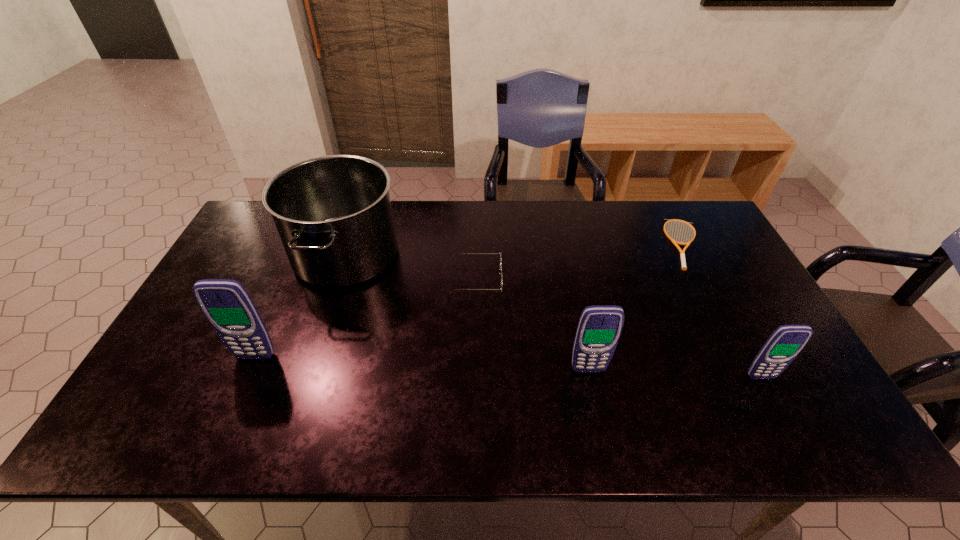
The width and height of the screenshot is (960, 540). Find the location of `vacant area at the near edge`. vacant area at the near edge is located at coordinates (399, 390).

Locate an element on the screen. The width and height of the screenshot is (960, 540). vacant region at the left edge of the desktop is located at coordinates (267, 276).

In the image, there is a desktop. Find the location of `free space at the right edge`. free space at the right edge is located at coordinates (744, 349).

Find the location of `free space at the far right corner of the desktop`. free space at the far right corner of the desktop is located at coordinates (679, 204).

Locate an element on the screen. The image size is (960, 540). vacant space at the near right corner is located at coordinates (785, 388).

Where is `unoccupied area between the second cellular telephone from left to right and the fourth object from right to left`? This screenshot has width=960, height=540. unoccupied area between the second cellular telephone from left to right and the fourth object from right to left is located at coordinates (532, 325).

Identify the location of free space between the leftmost cellular telephone and the sunglasses. The width and height of the screenshot is (960, 540). (366, 318).

You are a GUI agent. You are given a task and a screenshot of the screen. Output one action in this format:
    pyautogui.click(x=<x>, y=<y>)
    Task: Click on the free space between the second shortest object and the saucepan
    Image resolution: width=960 pixels, height=540 pixels.
    Given the screenshot: What is the action you would take?
    pyautogui.click(x=411, y=267)

The image size is (960, 540). What are the coordinates of `empty space that is in between the sunglasses and the saucepan` in the screenshot? It's located at (411, 267).

Identify the location of vacant space that's between the farthest cellular telephone and the third object from left to right. This screenshot has height=540, width=960. (366, 318).